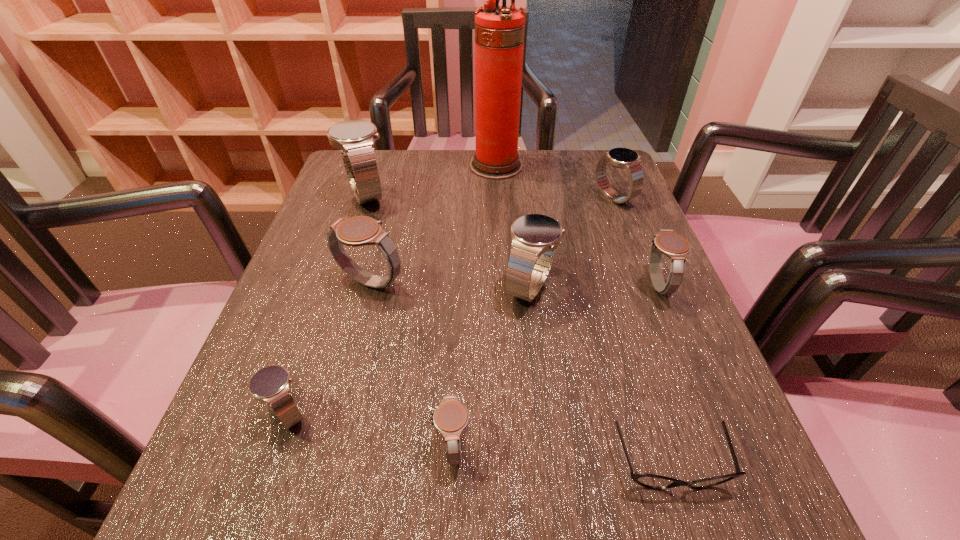
This screenshot has width=960, height=540. I want to click on free area in between the smallest gray watch and the third smallest blue watch, so point(492,366).

Locate an element on the screen. The image size is (960, 540). free space between the nearest blue watch and the nearest gray watch is located at coordinates (370, 429).

Find the location of a particular element. vacant area between the rightmost blue watch and the third watch from right to left is located at coordinates (572, 242).

Identify the location of free space between the shortest object and the fire extinguisher. (583, 315).

Locate an element on the screen. free area in between the rightmost gray watch and the smallest blue watch is located at coordinates (471, 349).

Locate which object is the third closest to the smallest gray watch. Please provide its 2D coordinates. Your answer should be formatted as a tuple, i.e. [(x, y)], where the tuple contains the x and y coordinates of a point satisfying the conditions above.

[(535, 237)]

The height and width of the screenshot is (540, 960). Find the location of `object identified as the third closest to the second smallest gray watch`. object identified as the third closest to the second smallest gray watch is located at coordinates (647, 480).

This screenshot has width=960, height=540. In order to click on the closest watch to the second biggest gray watch in this screenshot , I will do `click(535, 237)`.

Identify which watch is the closest to the shortest object. Please provide its 2D coordinates. Your answer should be formatted as a tuple, i.e. [(x, y)], where the tuple contains the x and y coordinates of a point satisfying the conditions above.

[(450, 418)]

This screenshot has width=960, height=540. Find the location of `blue watch that is the fourth closest to the second gray watch from right to left`. blue watch that is the fourth closest to the second gray watch from right to left is located at coordinates (624, 158).